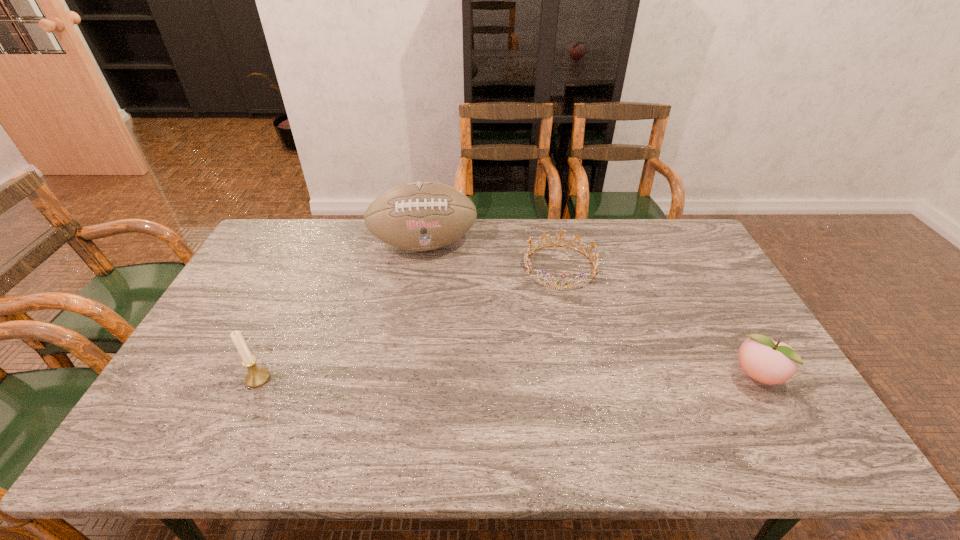
Find the location of a particular element. Image resolution: width=960 pixels, height=540 pixels. the leftmost object is located at coordinates (257, 376).

Identify the location of candle holder. (257, 376).

At what (x,y) coordinates should I click in order to perform the action: click on peach. Please return your answer as a coordinate pair (x, y). The height and width of the screenshot is (540, 960). Looking at the image, I should click on (761, 358).

What are the coordinates of `the rightmost object` in the screenshot? It's located at (761, 358).

Find the location of a particular element. the third object from left to right is located at coordinates (527, 261).

Find the location of a particular element. Image resolution: width=960 pixels, height=540 pixels. the shortest object is located at coordinates (527, 261).

Where is `the tallest object`? The height and width of the screenshot is (540, 960). the tallest object is located at coordinates (418, 216).

Image resolution: width=960 pixels, height=540 pixels. In order to click on football (American) in this screenshot , I will do `click(418, 216)`.

This screenshot has width=960, height=540. Identify the location of vacant area situated 0.310m on the back of the third shortest object. (299, 289).

Locate an element on the screen. vacant region located 0.210m on the left of the peach is located at coordinates 651,377.